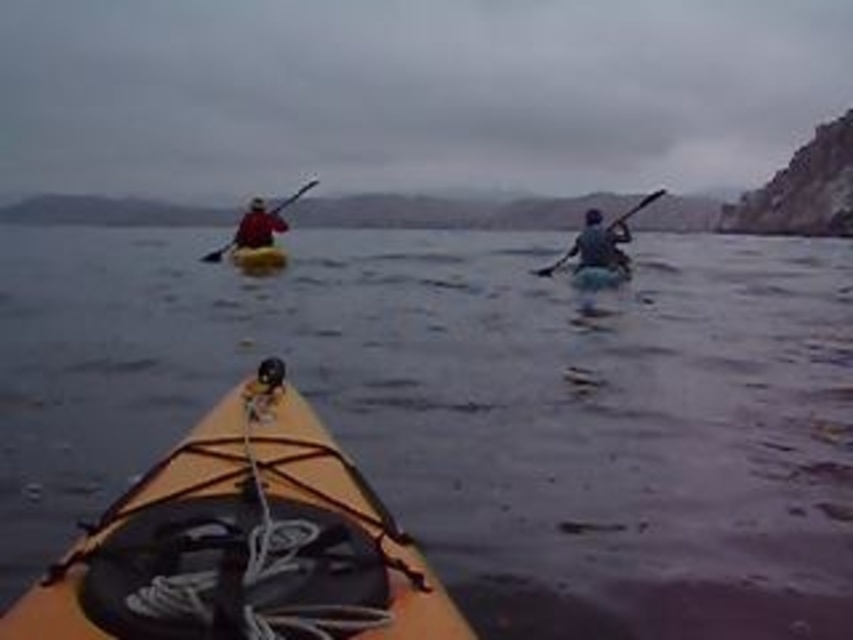
Is smooth water at center behind matte blue kayak at right?

No.

Between smooth water at center and matte blue kayak at right, which one has more height?

Standing taller between the two is smooth water at center.

Consider the image. Who is more distant from viewer, (108, 435) or (569, 253)?

The point (569, 253) is more distant.

Identify the location of smooth water at center. (473, 410).

Image resolution: width=853 pixels, height=640 pixels. I want to click on matte red jacket at upper left, so click(x=257, y=225).

Between matte red jacket at upper left and matte black paddle at upper left, which one is positioned higher?

Positioned higher is matte black paddle at upper left.

Is point (250, 212) positioned after point (273, 212)?

That is False.

The width and height of the screenshot is (853, 640). In order to click on matte red jacket at upper left in this screenshot , I will do `click(257, 225)`.

Is matte red jacket at upper left thinner than smooth black paddle at right?

Indeed, matte red jacket at upper left has a lesser width compared to smooth black paddle at right.

Who is more forward, (251,204) or (616,220)?

Point (616,220) is more forward.

Who is more forward, (245,237) or (628,216)?

Point (245,237)

You are a GUI agent. You are given a task and a screenshot of the screen. Output one action in this format:
    pyautogui.click(x=<x>, y=<y>)
    Task: Click on the matte red jacket at upper left
    This screenshot has width=853, height=640.
    Given the screenshot: What is the action you would take?
    pyautogui.click(x=257, y=225)